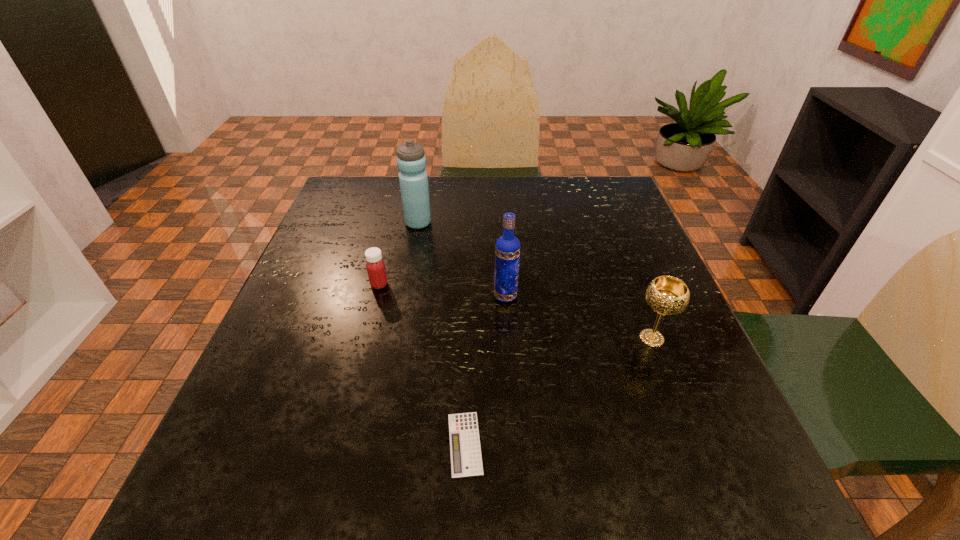
Where is `vacant space at the right edge of the desktop`? This screenshot has height=540, width=960. vacant space at the right edge of the desktop is located at coordinates (726, 444).

In the image, there is a desktop. Find the location of `free space at the far left corner`. free space at the far left corner is located at coordinates (373, 212).

The height and width of the screenshot is (540, 960). Identify the location of vacant space at the far right corner of the desktop. (596, 220).

Identify the location of free space at the near right corner of the desktop. This screenshot has height=540, width=960. (721, 509).

The width and height of the screenshot is (960, 540). Find the location of `free point between the nearest object and the fourth object from left to right`. free point between the nearest object and the fourth object from left to right is located at coordinates (485, 370).

Locate an element on the screen. The image size is (960, 540). free area in between the leftmost object and the third shortest object is located at coordinates (516, 312).

Image resolution: width=960 pixels, height=540 pixels. I want to click on unoccupied position between the medicine and the second object from right to left, so click(x=443, y=291).

Find the location of a particular element. vacant area that lies between the farthest object and the leftmost object is located at coordinates (398, 254).

At what (x,y) coordinates should I click in order to perform the action: click on vacant region between the second object from right to left and the calculator. Please return your answer as a coordinate pair (x, y). The width and height of the screenshot is (960, 540). Looking at the image, I should click on (485, 370).

The height and width of the screenshot is (540, 960). What are the coordinates of `free space between the shortest object and the second object from left to right` in the screenshot? It's located at (442, 333).